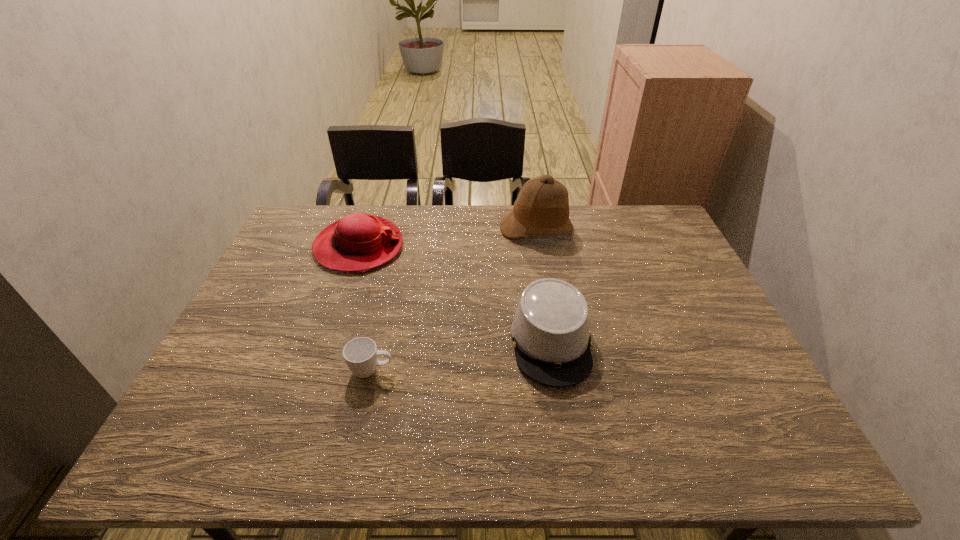
The image size is (960, 540). I want to click on free point that satisfies the following two spatial constraints: 1. on the front-facing side of the nearest hat; 2. with the handle on the side of the cup, so click(556, 370).

Where is `free space that satisfies the following two spatial constraints: 1. on the front-facing side of the tallest object; 2. with the handle on the side of the shortest object`? free space that satisfies the following two spatial constraints: 1. on the front-facing side of the tallest object; 2. with the handle on the side of the shortest object is located at coordinates (561, 370).

I want to click on free spot that satisfies the following two spatial constraints: 1. on the front-facing side of the tallest hat; 2. at the front of the leftmost hat with a bow, so [540, 247].

This screenshot has width=960, height=540. I want to click on vacant region that satisfies the following two spatial constraints: 1. on the front-facing side of the nearest hat; 2. with the handle on the side of the cup, so click(556, 370).

The image size is (960, 540). In order to click on blank area in the image that satisfies the following two spatial constraints: 1. on the front-facing side of the nearest hat; 2. with the handle on the side of the shortest object in this screenshot , I will do 556,370.